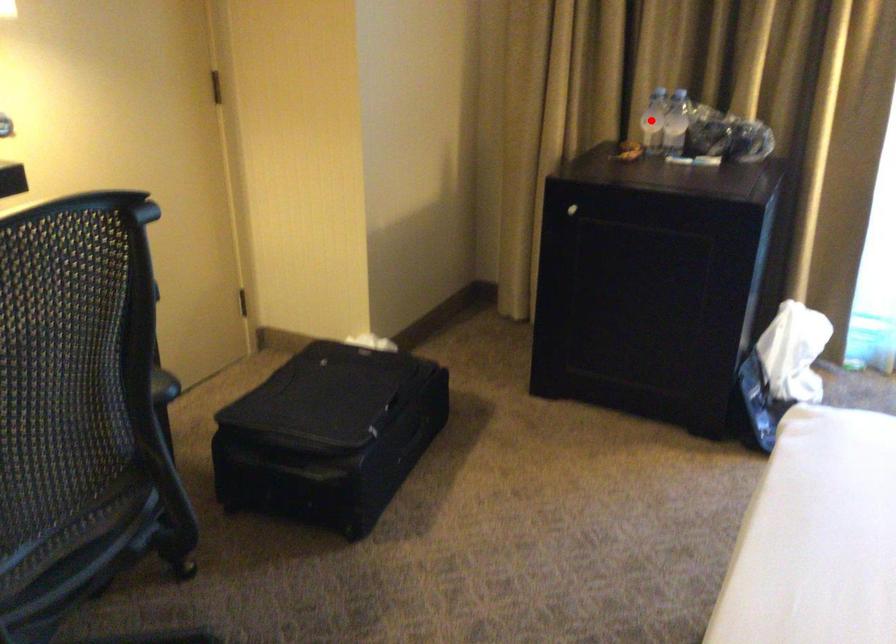
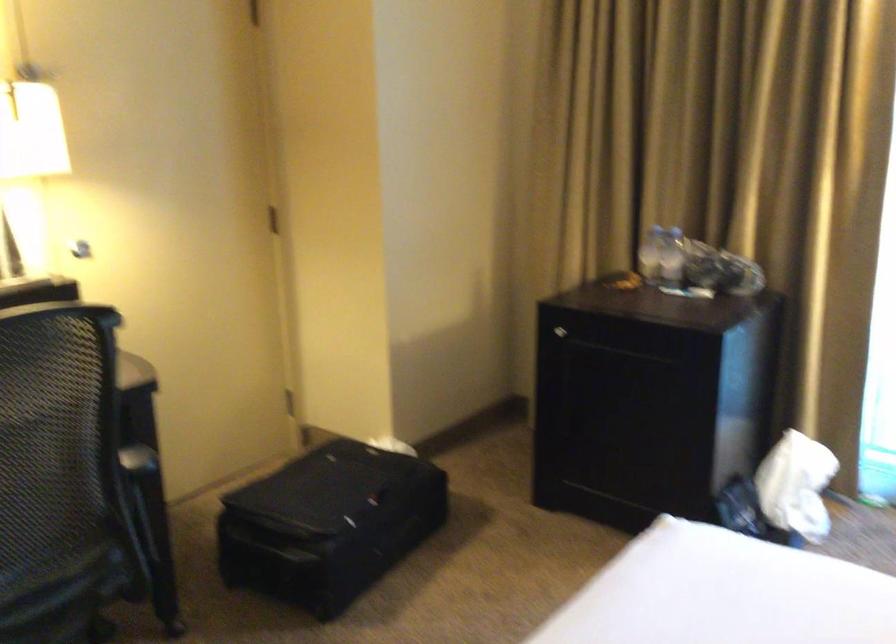
Where in the second image is the point corresponding to the highlighted location from the first image?

(650, 252)